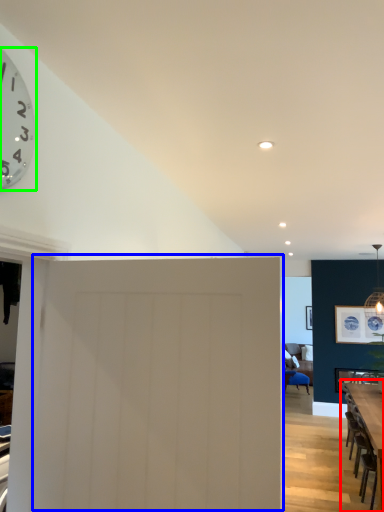
Question: Which is nearer to the table (highlighted by a red box)? door (highlighted by a blue box) or wall clock (highlighted by a green box).

Choices:
 (A) door
 (B) wall clock

Answer: (A)